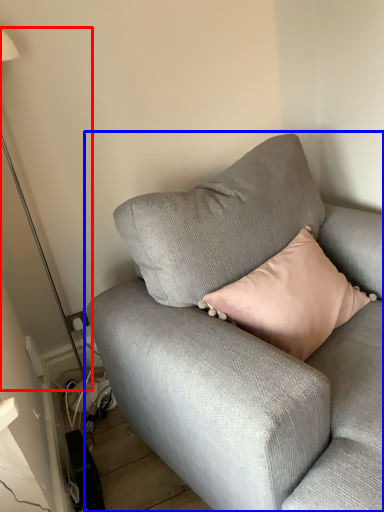
Question: Which of the following is the farthest to the observer, table lamp (highlighted by a red box) or studio couch (highlighted by a blue box)?

Choices:
 (A) table lamp
 (B) studio couch

Answer: (A)